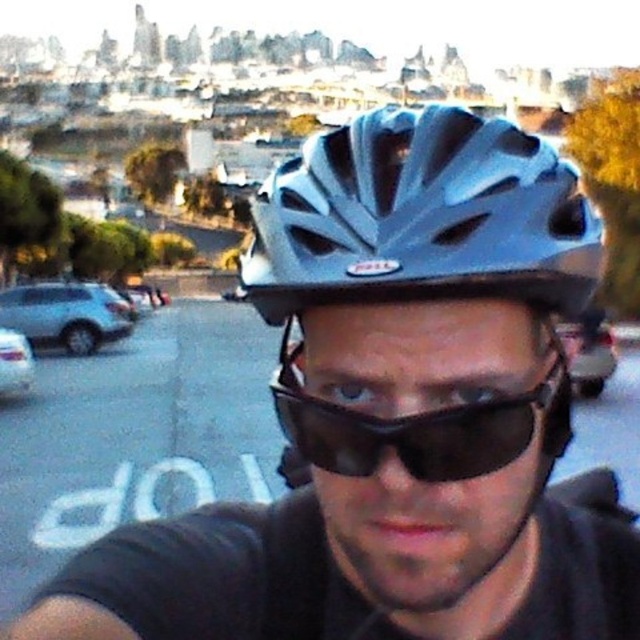
Is matte gray helmet at center to the right of black matte sunglasses at center from the viewer's perspective?

Incorrect, matte gray helmet at center is not on the right side of black matte sunglasses at center.

Is point (529, 241) closer to camera compared to point (547, 428)?

Yes, point (529, 241) is closer to viewer.

You are a GUI agent. You are given a task and a screenshot of the screen. Output one action in this format:
    pyautogui.click(x=<x>, y=<y>)
    Task: Click on the matte gray helmet at center
    Image resolution: width=640 pixels, height=640 pixels.
    Given the screenshot: What is the action you would take?
    pyautogui.click(x=422, y=216)